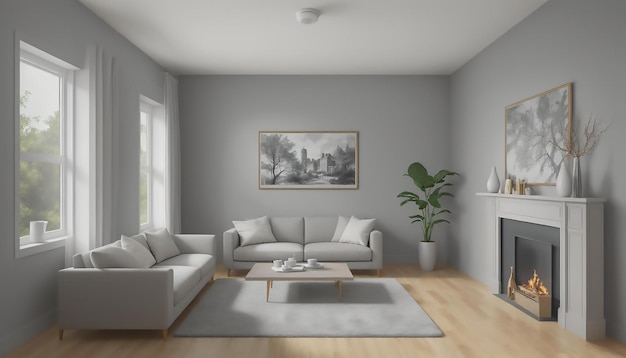
What are the coordinates of `rug` in the screenshot? It's located at (231, 320).